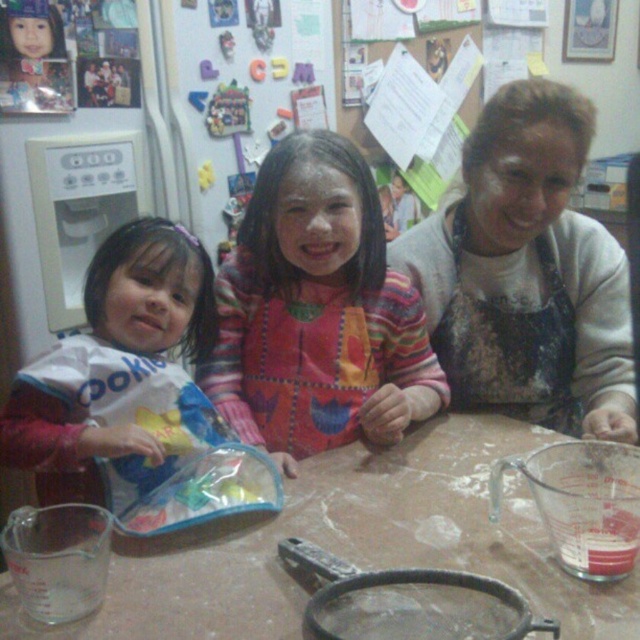
You are a photographer taking a photo of the dark gray apron at center and the multicolored fabric dress at center. Which one will appear larger in the photo?

The dark gray apron at center will appear larger in the photo because it is closer to the viewer than the multicolored fabric dress at center.

You are standing in the kitchen scene and want to reach both the point at coordinates point (209, 360) and point (140, 310). Which point will you reach first?

You will reach point (209, 360) first because it is closer to you than point (140, 310), which is further away.